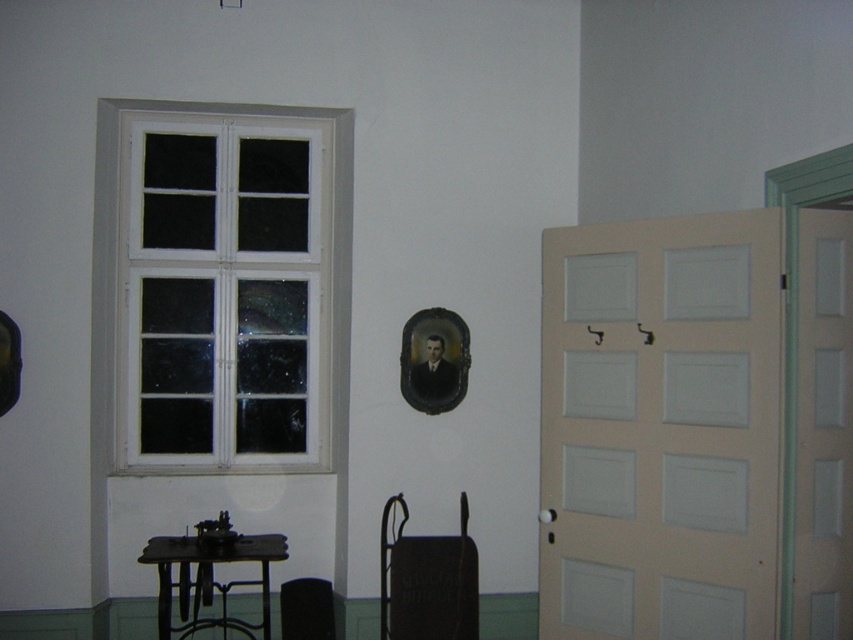
Is matte black chair at lower center to the right of metallic black table at lower left from the viewer's perspective?

Yes, matte black chair at lower center is to the right of metallic black table at lower left.

This screenshot has height=640, width=853. I want to click on matte black chair at lower center, so click(x=427, y=580).

Identify the location of matte black chair at lower center. (427, 580).

Is white wooden window at upper left smaller than matte black chair at lower center?

Actually, white wooden window at upper left might be larger than matte black chair at lower center.

At what (x,y) coordinates should I click in order to perform the action: click on white wooden window at upper left. Please return your answer as a coordinate pair (x, y). Looking at the image, I should click on (225, 291).

Which of these two, white matte door at right or metallic black table at lower left, stands shorter?

metallic black table at lower left is shorter.

Between white matte door at right and metallic black table at lower left, which one has more height?

With more height is white matte door at right.

Is point (605, 244) positioned behind point (219, 557)?

Yes.

Where is `white matte door at right`? white matte door at right is located at coordinates (660, 428).